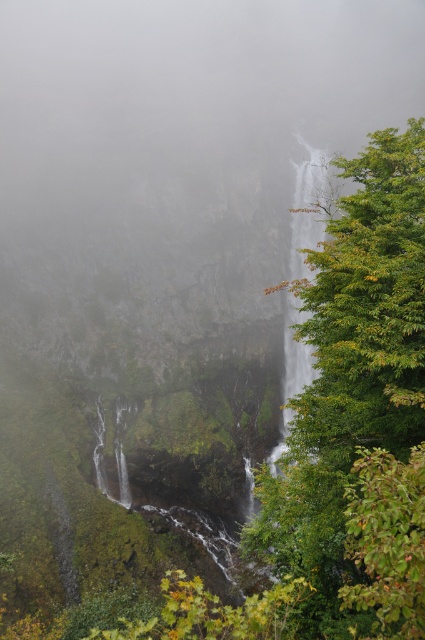
Question: Among these points, which one is farthest from the camera?

Choices:
 (A) (357, 220)
 (B) (127, 150)

Answer: (B)

Question: Can you confirm if foggy mist at center is wider than green leafy tree at right?

Choices:
 (A) yes
 (B) no

Answer: (A)

Question: Which object appears closest to the camera in this image?

Choices:
 (A) clear water at center
 (B) green leafy tree at right

Answer: (B)

Question: Is foggy mist at center above green leafy tree at right?

Choices:
 (A) no
 (B) yes

Answer: (B)

Question: Which object is farther from the camera taking this photo?

Choices:
 (A) green leafy tree at right
 (B) foggy mist at center
 (C) clear water at center

Answer: (B)

Question: Can you confirm if green leafy tree at right is positioned to the left of clear water at center?

Choices:
 (A) yes
 (B) no

Answer: (A)